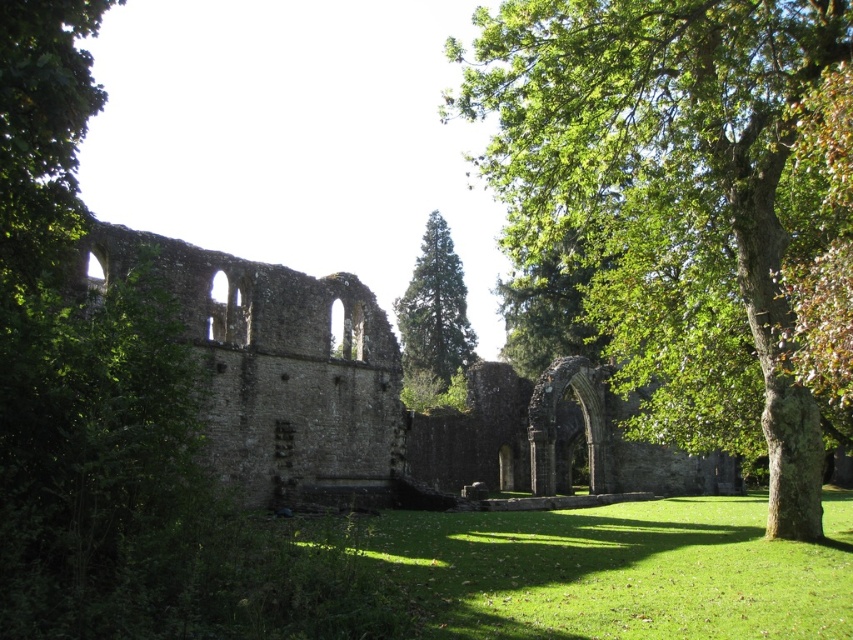
Who is more forward, (579, 550) or (440, 376)?

Positioned in front is point (579, 550).

Between point (622, 573) and point (436, 272), which one is positioned behind?

Point (436, 272)

Is point (543, 598) less distant than point (424, 301)?

That is True.

I want to click on green grass at lower center, so click(x=608, y=570).

Can you confirm if green leafy tree at center is thinner than green coniferous tree at center?

No, green leafy tree at center is not thinner than green coniferous tree at center.

Which is behind, point (788, 467) or point (422, 388)?

The point (422, 388) is behind.

Locate an element on the screen. green leafy tree at center is located at coordinates (691, 202).

Is stone archway at center wider than green grass at lower center?

Correct, the width of stone archway at center exceeds that of green grass at lower center.

Who is more distant from viewer, (386, 449) or (624, 552)?

The point (386, 449) is more distant.

What do you see at coordinates (370, 392) in the screenshot? The height and width of the screenshot is (640, 853). I see `stone archway at center` at bounding box center [370, 392].

Find the location of a particular element. stone archway at center is located at coordinates (370, 392).